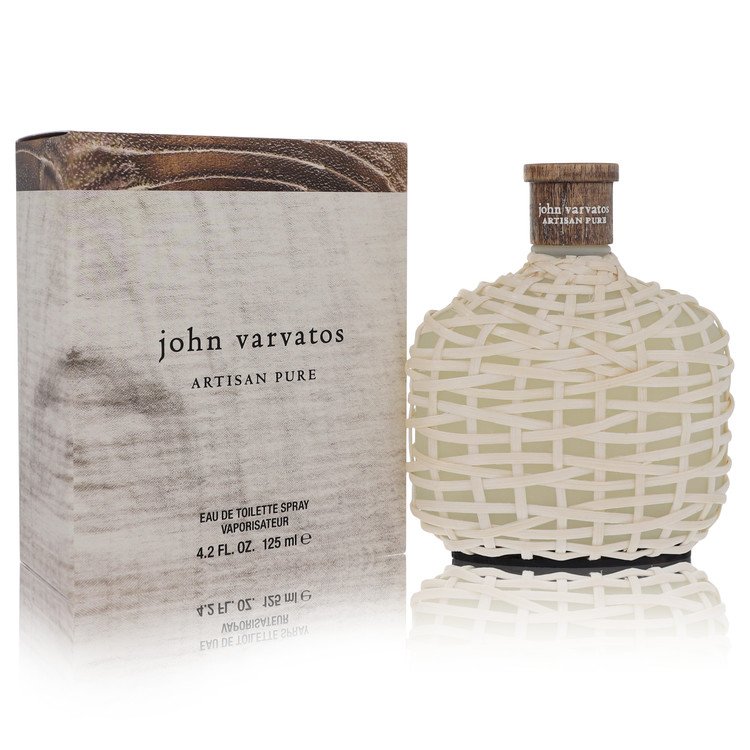
Find the location of a particular element. The image size is (750, 750). toilette is located at coordinates coord(254,516).